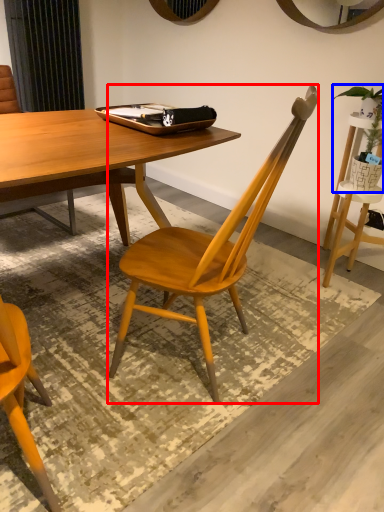
Question: Which object is further to the camera taking this photo, chair (highlighted by a red box) or houseplant (highlighted by a blue box)?

Choices:
 (A) chair
 (B) houseplant

Answer: (B)